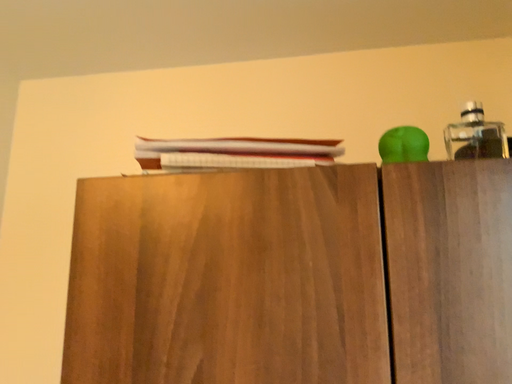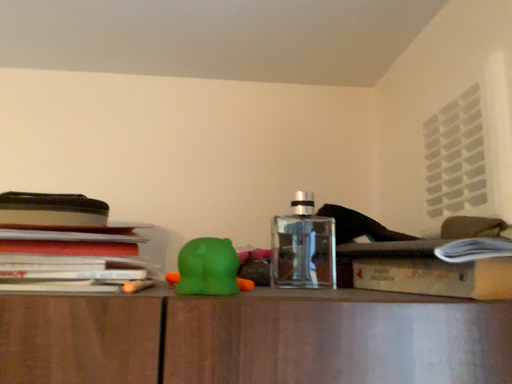
Question: How did the camera likely rotate when shooting the video?

Choices:
 (A) rotated right
 (B) rotated left

Answer: (A)